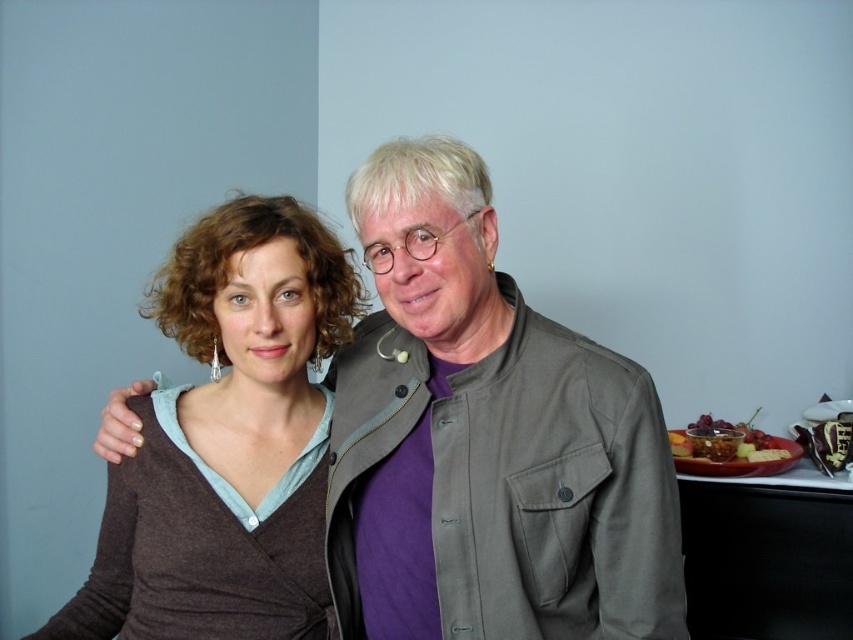
You are a photographer holding a camera. You want to take a photo of the matte gray jacket at center without moving the camera. Is the jacket within the camera lens range? The camera can focus on objects up to 38 inches away.

The matte gray jacket at center and camera are 37.99 inches apart, which is within the camera lens range of 38 inches. Therefore, the jacket is within the focus range and can be captured clearly.

You are standing in front of the image and want to locate the matte gray jacket at center. What are its coordinates?

The coordinates of the matte gray jacket at center are at point (486, 440).